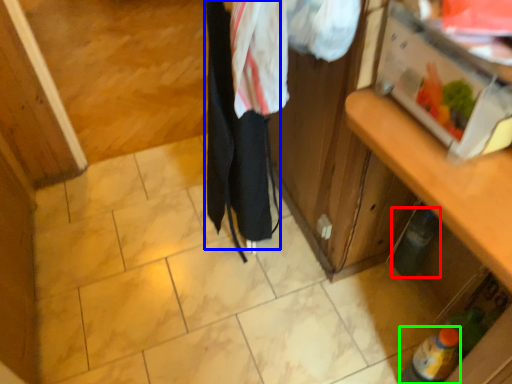
Question: Which object is the closest to the bottle (highlighted by a red box)? Choose among these: clothing (highlighted by a blue box) or bottle (highlighted by a green box).

Choices:
 (A) clothing
 (B) bottle

Answer: (B)